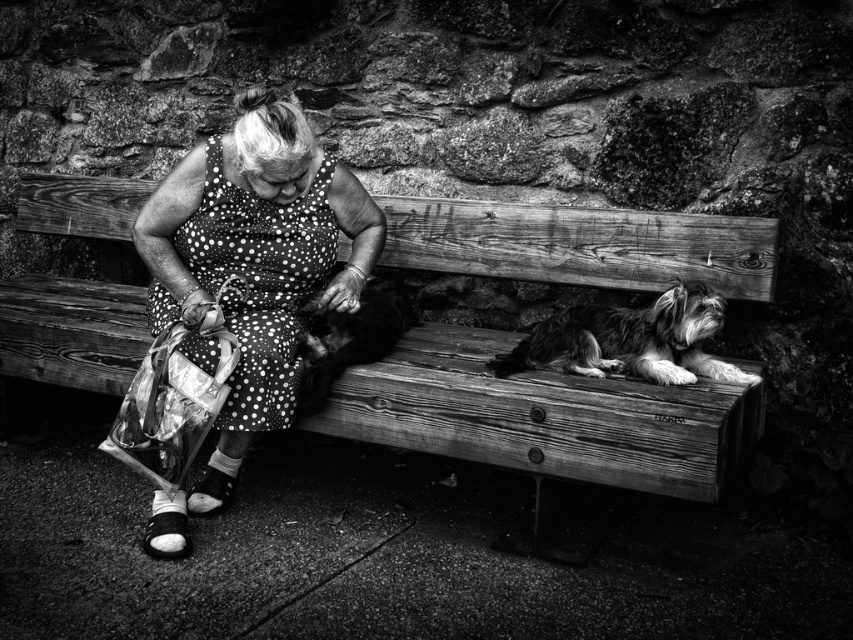
Question: Can you confirm if polka dot fabric dress at center is thinner than soft fur dog at center?

Choices:
 (A) yes
 (B) no

Answer: (B)

Question: Which point is closer to the camera?

Choices:
 (A) wooden bench at center
 (B) polka dot fabric dress at center
 (C) soft fur dog at center

Answer: (A)

Question: Which object is closer to the camera taking this photo?

Choices:
 (A) wooden bench at center
 (B) soft fur dog at center

Answer: (A)

Question: Which object is farther from the camera taking this photo?

Choices:
 (A) wooden bench at center
 (B) soft fur dog at center
 (C) shaggy fur dog at right
 (D) polka dot fabric dress at center

Answer: (B)

Question: Does shaggy fur dog at right have a greater width compared to soft fur dog at center?

Choices:
 (A) yes
 (B) no

Answer: (A)

Question: Observing the image, what is the correct spatial positioning of wooden bench at center in reference to shaggy fur dog at right?

Choices:
 (A) right
 (B) left

Answer: (B)